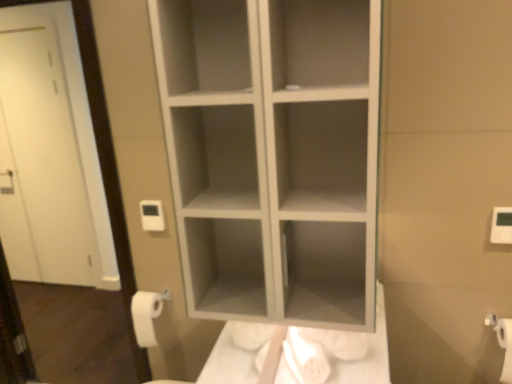
Measure the distance between point (x=350, y=350) and camera.

The depth of point (x=350, y=350) is 4.27 feet.

Where is `white cotton bath towel at lower center`? Image resolution: width=512 pixels, height=384 pixels. white cotton bath towel at lower center is located at coordinates (320, 351).

What do you see at coordinates (320, 351) in the screenshot? I see `white cotton bath towel at lower center` at bounding box center [320, 351].

What are the coordinates of `white cotton bath towel at lower center` in the screenshot? It's located at (320, 351).